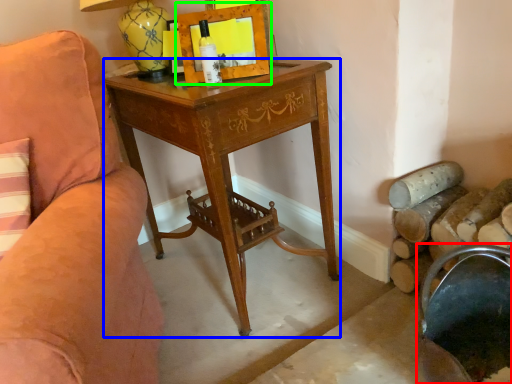
Question: Estimate the real-world distances between objects in this image. Which object is farther from rocking chair (highlighted by a red box), desk (highlighted by a blue box) or picture frame (highlighted by a green box)?

Choices:
 (A) desk
 (B) picture frame

Answer: (B)